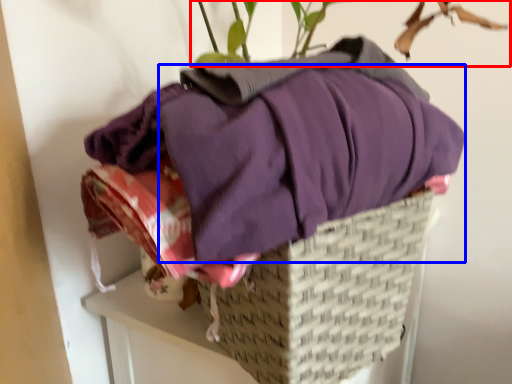
Question: Which of the following is the closest to the observer, houseplant (highlighted by a red box) or clothing (highlighted by a blue box)?

Choices:
 (A) houseplant
 (B) clothing

Answer: (A)